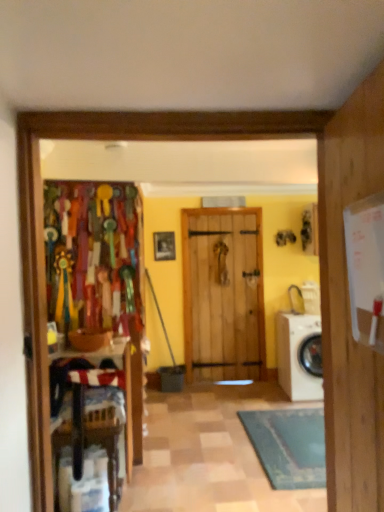
Image resolution: width=384 pixels, height=512 pixels. I want to click on wooden frame at center, so click(164, 246).

Which of these two, wooden chair at left or wooden frame at center, stands shorter?

wooden frame at center.

Which is behind, wooden chair at left or wooden frame at center?

Positioned behind is wooden frame at center.

Is wooden frame at center at the back of wooden chair at left?

wooden chair at left does not have its back to wooden frame at center.

How many degrees apart are the facing directions of wooden chair at left and wooden frame at center?

The angle between the facing direction of wooden chair at left and the facing direction of wooden frame at center is 90 degrees.

Which object is positioned more to the left, wooden frame at center or white glossy washing machine at lower right?

Positioned to the left is wooden frame at center.

Is wooden frame at center smaller than white glossy washing machine at lower right?

Correct, wooden frame at center occupies less space than white glossy washing machine at lower right.

Is wooden frame at center oriented towards white glossy washing machine at lower right?

No, wooden frame at center is not facing towards white glossy washing machine at lower right.

Is wooden frame at center positioned behind white glossy washing machine at lower right?

Yes, wooden frame at center is further from the viewer.

Can you tell me how much wooden chair at left and white glossy washing machine at lower right differ in facing direction?

90 degrees separate the facing orientations of wooden chair at left and white glossy washing machine at lower right.

From their relative heights in the image, would you say wooden chair at left is taller or shorter than white glossy washing machine at lower right?

Clearly, wooden chair at left is shorter compared to white glossy washing machine at lower right.

Is wooden chair at left far from white glossy washing machine at lower right?

Yes, wooden chair at left is far from white glossy washing machine at lower right.

Could you tell me if wooden frame at center is turned towards wooden chair at left?

No, wooden frame at center is not facing towards wooden chair at left.

Considering the positions of objects wooden frame at center and wooden chair at left in the image provided, who is in front, wooden frame at center or wooden chair at left?

wooden chair at left is more forward.

From the picture: From a real-world perspective, between wooden frame at center and wooden chair at left, who is vertically lower?

From a 3D spatial view, wooden chair at left is below.

Is white glossy washing machine at lower right oriented away from wooden frame at center?

No, white glossy washing machine at lower right is not facing the opposite direction of wooden frame at center.

Would you say white glossy washing machine at lower right is a long distance from wooden frame at center?

Indeed, white glossy washing machine at lower right is not near wooden frame at center.

In the scene shown: Between white glossy washing machine at lower right and wooden frame at center, which one appears on the right side from the viewer's perspective?

From the viewer's perspective, white glossy washing machine at lower right appears more on the right side.

Can you confirm if white glossy washing machine at lower right is thinner than wooden frame at center?

No, white glossy washing machine at lower right is not thinner than wooden frame at center.

Looking at this image, which is farther from the camera, (302, 340) or (70, 490)?

The point (302, 340) is more distant.

From the image's perspective, would you say white glossy washing machine at lower right is shown under wooden chair at left?

No.

Which object is more forward, white glossy washing machine at lower right or wooden chair at left?

wooden chair at left is closer to the camera.

Identify the location of washing machine above the wooden chair at left (from a real-world perspective). The height and width of the screenshot is (512, 384). (299, 356).

At what (x,y) coordinates should I click in order to perform the action: click on picture frame that is behind the wooden chair at left. Please return your answer as a coordinate pair (x, y). Image resolution: width=384 pixels, height=512 pixels. Looking at the image, I should click on (164, 246).

Locate an element on the screen. The height and width of the screenshot is (512, 384). picture frame located on the left of white glossy washing machine at lower right is located at coordinates (x=164, y=246).

Looking at this image, based on their spatial positions, is white glossy washing machine at lower right or wooden chair at left further from wooden frame at center?

Among the two, wooden chair at left is located further to wooden frame at center.

Considering their positions, is wooden frame at center positioned further to white glossy washing machine at lower right than wooden chair at left?

Based on the image, wooden chair at left appears to be further to white glossy washing machine at lower right.

Considering their positions, is wooden chair at left positioned further to white glossy washing machine at lower right than wooden frame at center?

Among the two, wooden chair at left is located further to white glossy washing machine at lower right.

Estimate the real-world distances between objects in this image. Which object is closer to wooden frame at center, wooden chair at left or white glossy washing machine at lower right?

white glossy washing machine at lower right is closer to wooden frame at center.

Looking at the image, which one is located further to wooden chair at left, white glossy washing machine at lower right or wooden frame at center?

The object further to wooden chair at left is wooden frame at center.

From the image, which object appears to be nearer to wooden chair at left, wooden frame at center or white glossy washing machine at lower right?

white glossy washing machine at lower right is positioned closer to the anchor wooden chair at left.

The height and width of the screenshot is (512, 384). I want to click on washing machine between wooden chair at left and wooden frame at center from front to back, so click(299, 356).